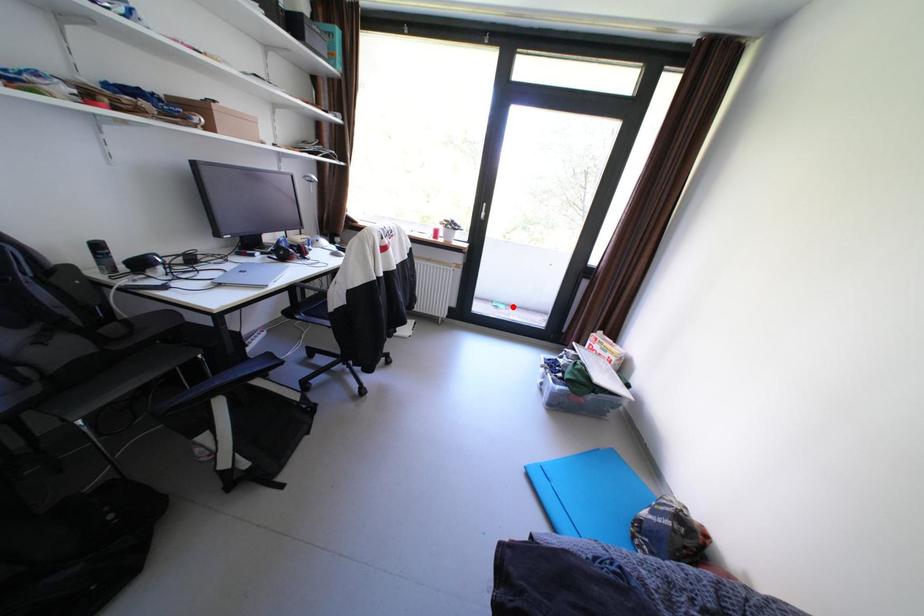
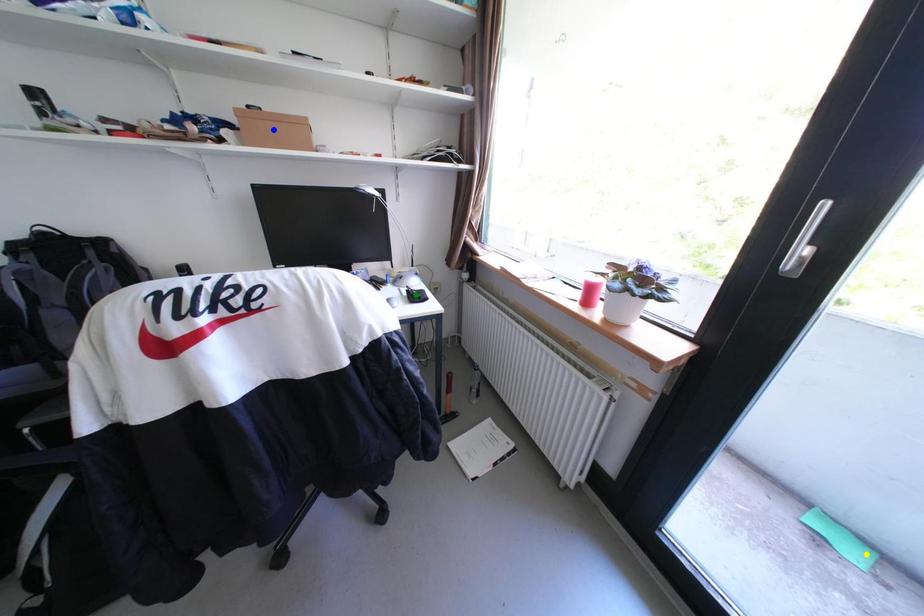
Question: I am providing you with two images of the same scene from different viewpoints. A red point is marked on the first image. You are given multiple points on the second image. Which point in image 2 represents the same 3d spot as the red point in image 1?

Choices:
 (A) green point
 (B) blue point
 (C) yellow point

Answer: (C)